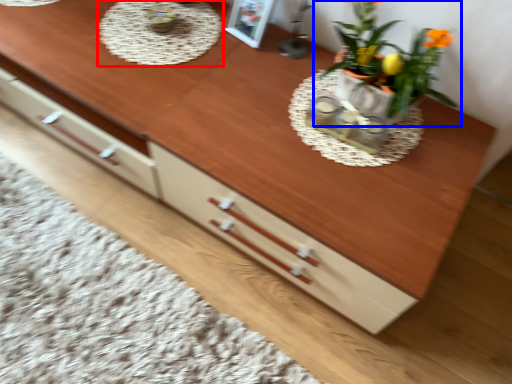
Question: Which object appears farthest to the camera in this image, round table (highlighted by a red box) or houseplant (highlighted by a blue box)?

Choices:
 (A) round table
 (B) houseplant

Answer: (A)